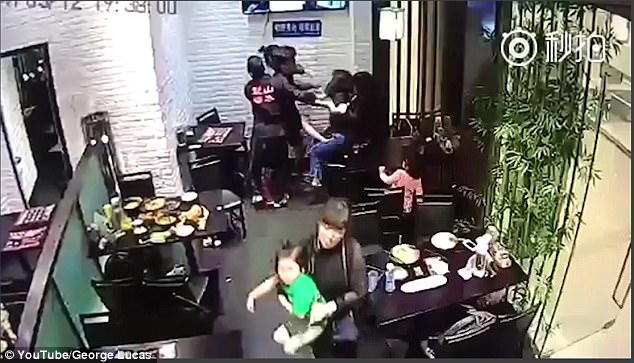
Locate an element on the screen. This screenshot has height=363, width=634. glass door is located at coordinates (600, 204).